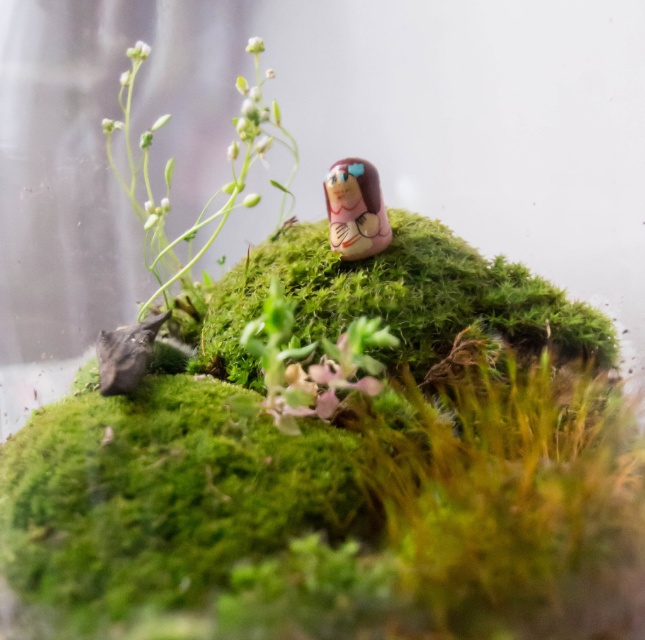
Question: Does green matte plant at upper left have a lesser width compared to matte pink figurine at center?

Choices:
 (A) yes
 (B) no

Answer: (B)

Question: Which point is closer to the camera taking this photo?

Choices:
 (A) (328, 186)
 (B) (166, 237)

Answer: (A)

Question: Where is green matte plant at upper left located in relation to matte pink figurine at center in the image?

Choices:
 (A) above
 (B) below

Answer: (A)

Question: Is green matte plant at upper left smaller than matte pink figurine at center?

Choices:
 (A) yes
 (B) no

Answer: (B)

Question: Which point is farther to the camera?

Choices:
 (A) (339, 176)
 (B) (132, 76)

Answer: (B)